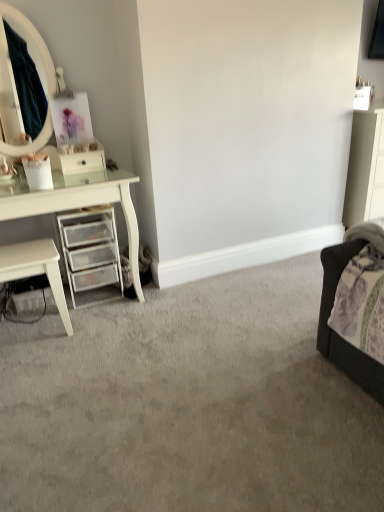
The height and width of the screenshot is (512, 384). What are the coordinates of `free location above white glossy nightstand at left (from a real-world perspective)` in the screenshot? It's located at (23, 254).